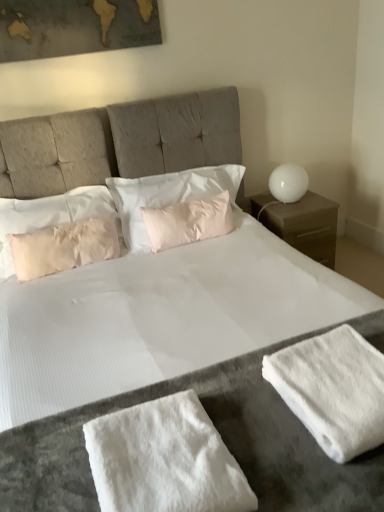
This screenshot has height=512, width=384. What are the coordinates of `free spot to the left of white fluffy bath towel at lower right` in the screenshot? It's located at (255, 413).